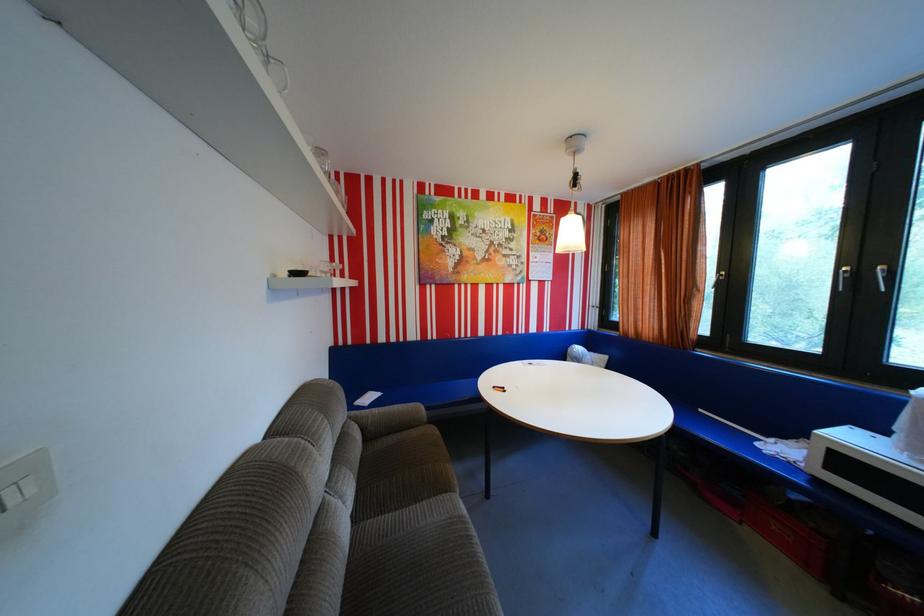
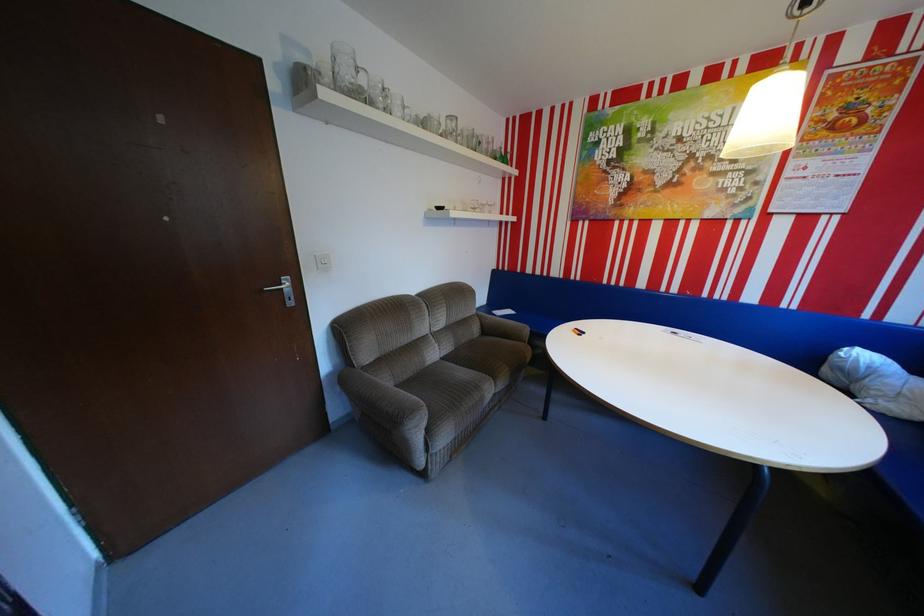
Where in the second image is the point corresponding to (590,347) from the first image?

(874, 355)